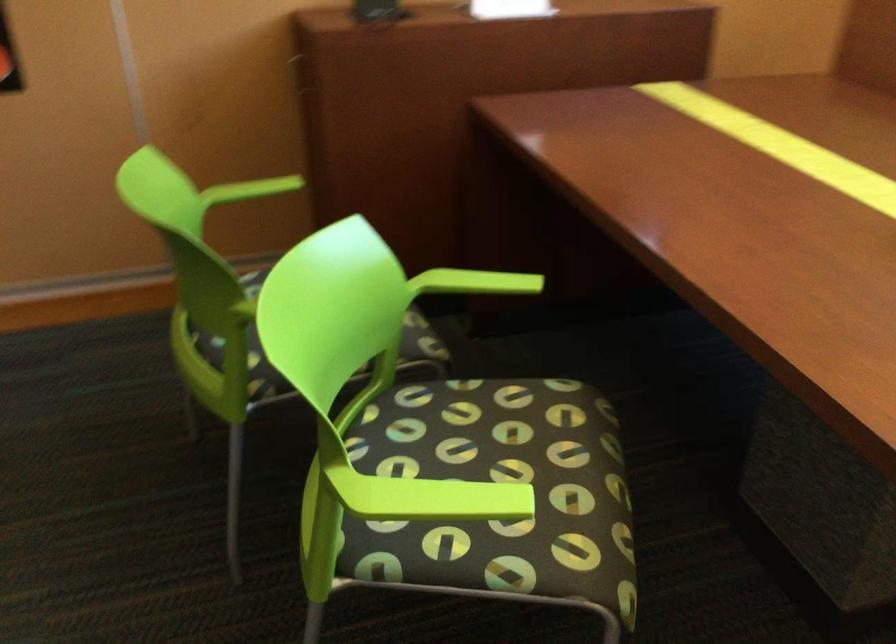
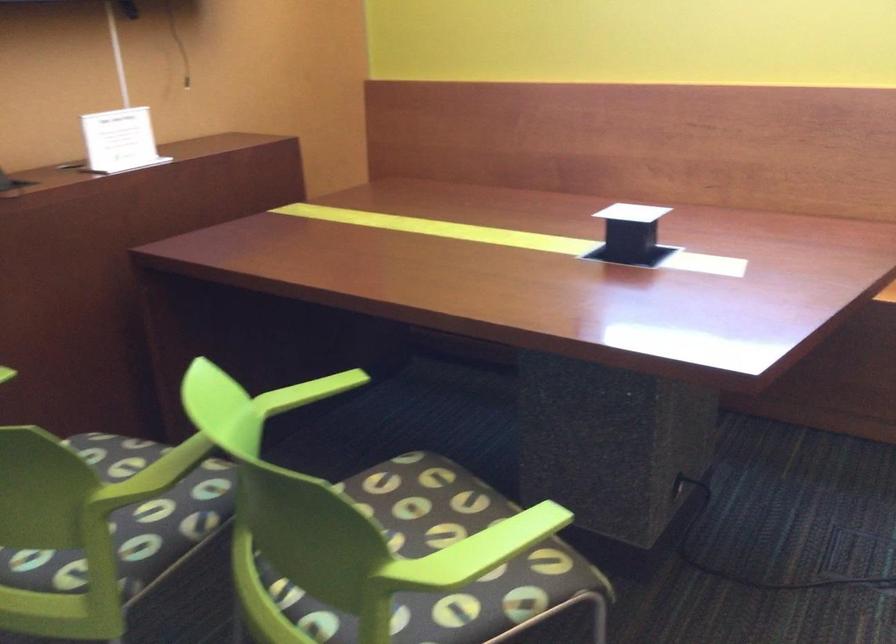
The point at (531, 410) is marked in the first image. Where is the corresponding point in the second image?

(403, 487)